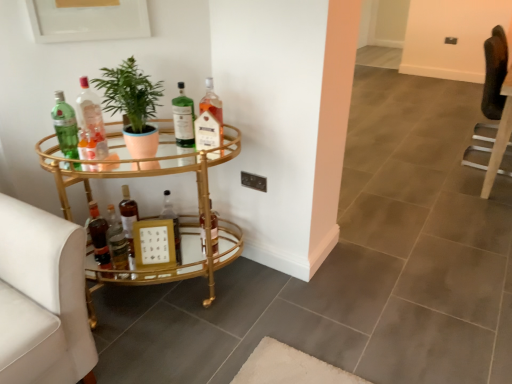
At what (x,y) coordinates should I click in order to perform the action: click on free space behind leather swivel chair at right, the 2th swivel chair from the left. Please return your answer as a coordinate pair (x, y). Image resolution: width=512 pixels, height=384 pixels. Looking at the image, I should click on (450, 140).